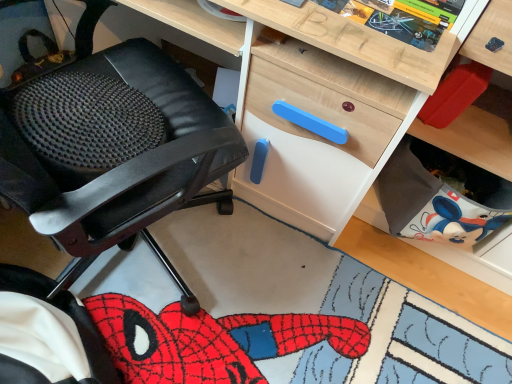
Question: From their relative heights in the image, would you say matte black office chair at left is taller or shorter than wooden comic book at upper center?

Choices:
 (A) short
 (B) tall

Answer: (B)

Question: Considering their positions, is matte black office chair at left located in front of or behind wooden comic book at upper center?

Choices:
 (A) front
 (B) behind

Answer: (A)

Question: From the image's perspective, is matte black office chair at left above or below wooden comic book at upper center?

Choices:
 (A) below
 (B) above

Answer: (A)

Question: From the image's perspective, is wooden comic book at upper center positioned above or below matte black office chair at left?

Choices:
 (A) below
 (B) above

Answer: (B)

Question: Considering the relative positions of wooden comic book at upper center and matte black office chair at left in the image provided, is wooden comic book at upper center to the left or to the right of matte black office chair at left?

Choices:
 (A) right
 (B) left

Answer: (A)

Question: Is wooden comic book at upper center taller or shorter than matte black office chair at left?

Choices:
 (A) tall
 (B) short

Answer: (B)

Question: Is wooden comic book at upper center inside the boundaries of matte black office chair at left, or outside?

Choices:
 (A) inside
 (B) outside

Answer: (B)